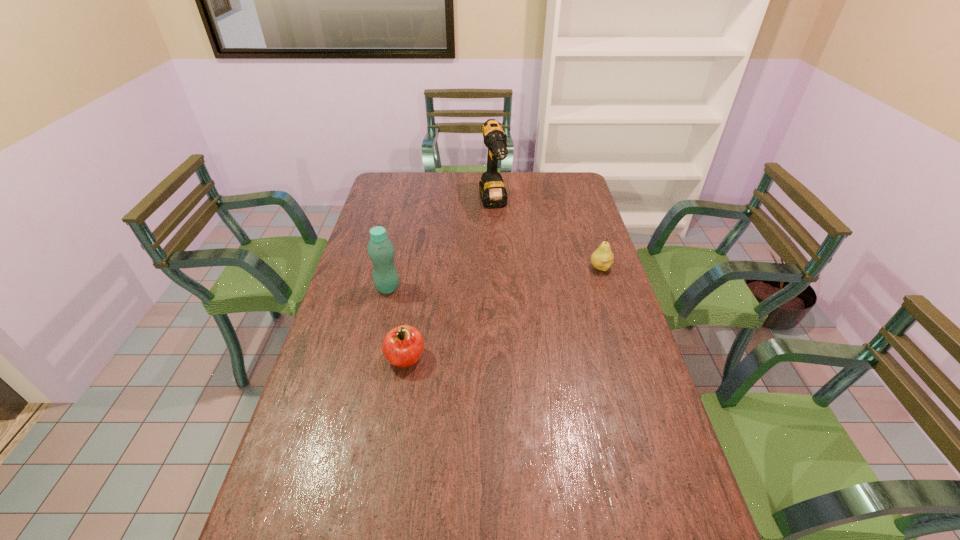
Find the location of `apple`. apple is located at coordinates (403, 346).

The height and width of the screenshot is (540, 960). What are the coordinates of `the second farthest object` in the screenshot? It's located at (602, 258).

Find the location of `pear`. pear is located at coordinates (602, 258).

Locate an element on the screen. This screenshot has height=540, width=960. water bottle is located at coordinates (381, 251).

Find the location of a particular element. Image resolution: width=960 pixels, height=540 pixels. the second tallest object is located at coordinates (381, 251).

At what (x,y) coordinates should I click in order to perform the action: click on the third object from left to right. Please return your answer as a coordinate pair (x, y). The height and width of the screenshot is (540, 960). Looking at the image, I should click on (493, 194).

You are a GUI agent. You are given a task and a screenshot of the screen. Output one action in this format:
    pyautogui.click(x=<x>, y=<y>)
    Task: Click on the drill
    Image resolution: width=960 pixels, height=540 pixels.
    Given the screenshot: What is the action you would take?
    pyautogui.click(x=493, y=194)

Where is `vacant space located on the left of the apple`? vacant space located on the left of the apple is located at coordinates (347, 357).

You are a GUI agent. You are given a task and a screenshot of the screen. Output one action in this format:
    pyautogui.click(x=<x>, y=<y>)
    Task: Click on the free spot located 0.290m on the front of the pear
    The height and width of the screenshot is (540, 960).
    Given the screenshot: What is the action you would take?
    pyautogui.click(x=623, y=339)

This screenshot has height=540, width=960. Identify the location of free point located at the front cap of the third farthest object. (518, 305).